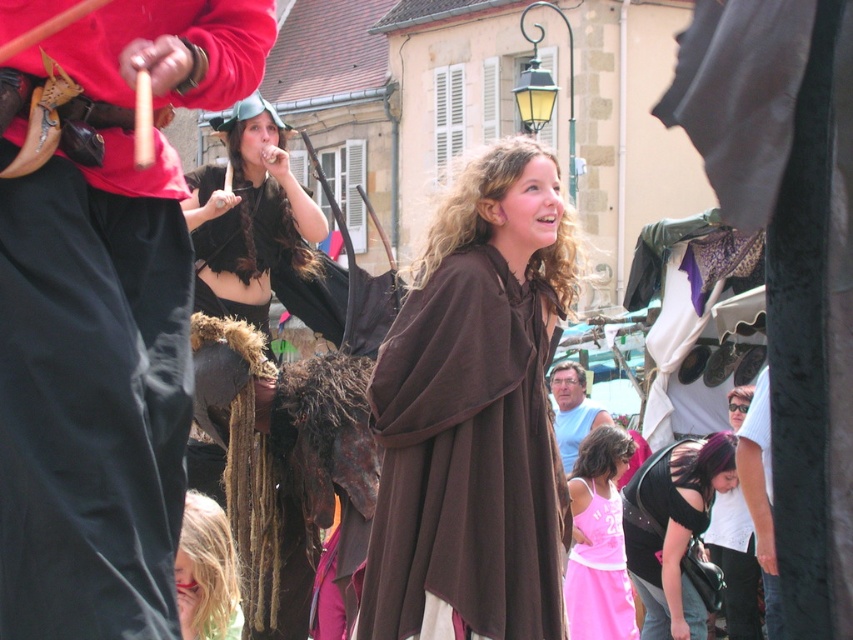
From the picture: You are a costume designer observing the scene. You need to determine which costume has a wider silhouette between the matte black pants at left and the light blue cotton shirt at center. Which one is wider?

The light blue cotton shirt at center has a wider silhouette than the matte black pants at left because the matte black pants at left is narrower in width compared to the light blue cotton shirt at center.

You are standing in the town square and want to take a photo of the point at coordinates (x=648, y=579). The camera you are using has a maximum focus range of 45 meters. Will the camera be able to focus on the point?

The point at coordinates (x=648, y=579) is 46.02 meters from the camera. Since the camera can only focus up to 45 meters, it will not be able to focus on the point.